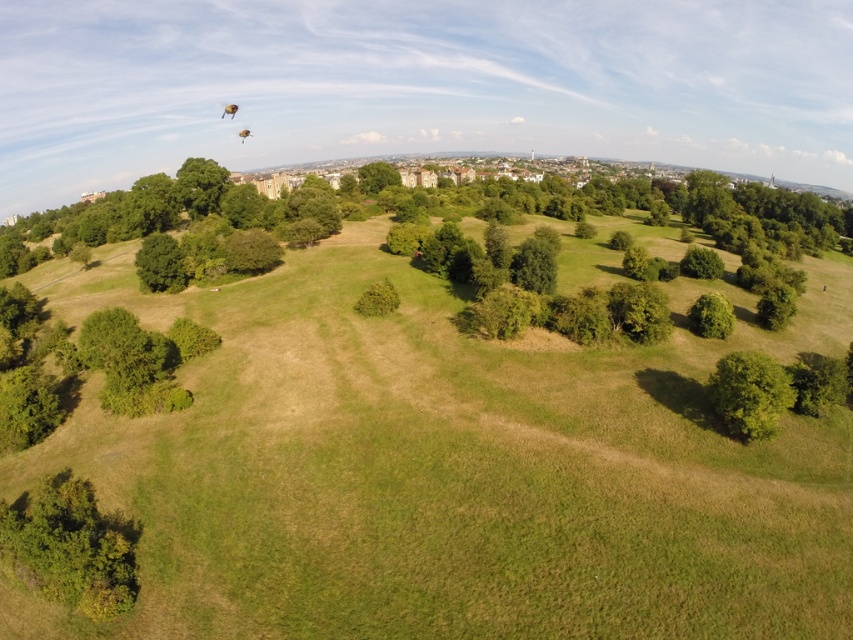
Between green leafy bush at lower left and green leafy tree at center-right, which one is positioned higher?

green leafy tree at center-right is higher up.

Can you confirm if green leafy bush at lower left is positioned above green leafy tree at center-right?

Actually, green leafy bush at lower left is below green leafy tree at center-right.

Where is `green leafy bush at lower left`? green leafy bush at lower left is located at coordinates (71, 547).

Is green grassy field at center smaller than green leafy tree at lower left?

No, green grassy field at center is not smaller than green leafy tree at lower left.

Is green grassy field at center below green leafy tree at lower left?

Correct, green grassy field at center is located below green leafy tree at lower left.

Find the location of a particular element. This screenshot has width=853, height=640. green grassy field at center is located at coordinates tap(448, 468).

Between green leafy bush at lower left and green leafy tree at lower right, which one appears on the left side from the viewer's perspective?

green leafy bush at lower left

Is green leafy bush at lower left to the right of green leafy tree at lower right from the viewer's perspective?

In fact, green leafy bush at lower left is to the left of green leafy tree at lower right.

Is point (100, 602) positioned behind point (776, 369)?

That is False.

Find the location of a particular element. green leafy bush at lower left is located at coordinates (71, 547).